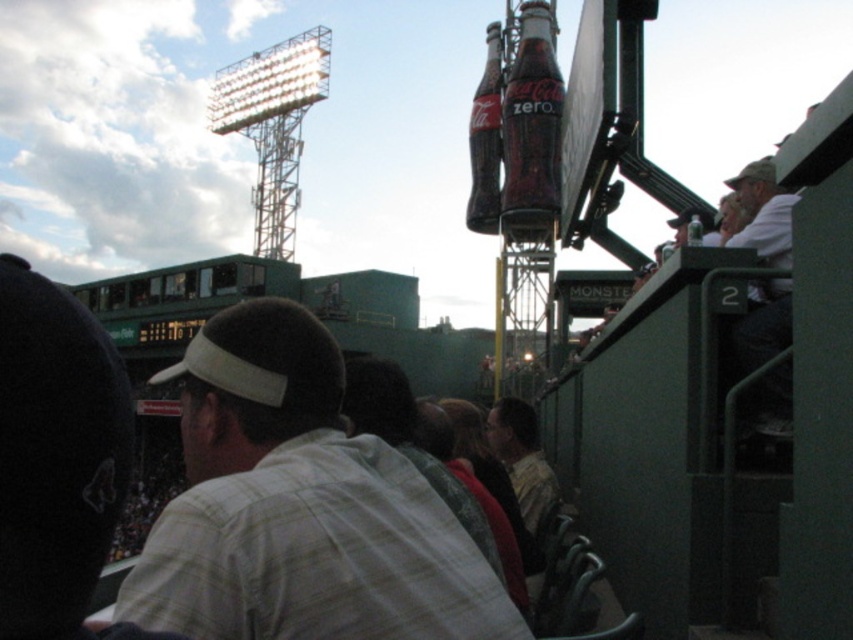
Question: Which point is closer to the camera?

Choices:
 (A) white cotton shirt at right
 (B) translucent glass coca-cola zero at center
 (C) clear glass bottle at upper right

Answer: (A)

Question: Is white plaid shirt at center bigger than translucent glass coca-cola zero at center?

Choices:
 (A) yes
 (B) no

Answer: (A)

Question: Observing the image, what is the correct spatial positioning of white plaid shirt at center in reference to translucent glass coca-cola zero at center?

Choices:
 (A) below
 (B) above

Answer: (A)

Question: Based on their relative distances, which object is farther from the white plaid shirt at center?

Choices:
 (A) white cotton shirt at right
 (B) clear glass bottle at upper right
 (C) translucent glass coca-cola zero at center

Answer: (C)

Question: Which of the following is the closest to the observer?

Choices:
 (A) translucent glass coca-cola bottle at center
 (B) clear glass bottle at upper right
 (C) white plaid shirt at center
 (D) white cotton shirt at right

Answer: (C)

Question: Considering the relative positions of translucent glass coca-cola zero at center and white cotton shirt at right in the image provided, where is translucent glass coca-cola zero at center located with respect to white cotton shirt at right?

Choices:
 (A) left
 (B) right

Answer: (A)